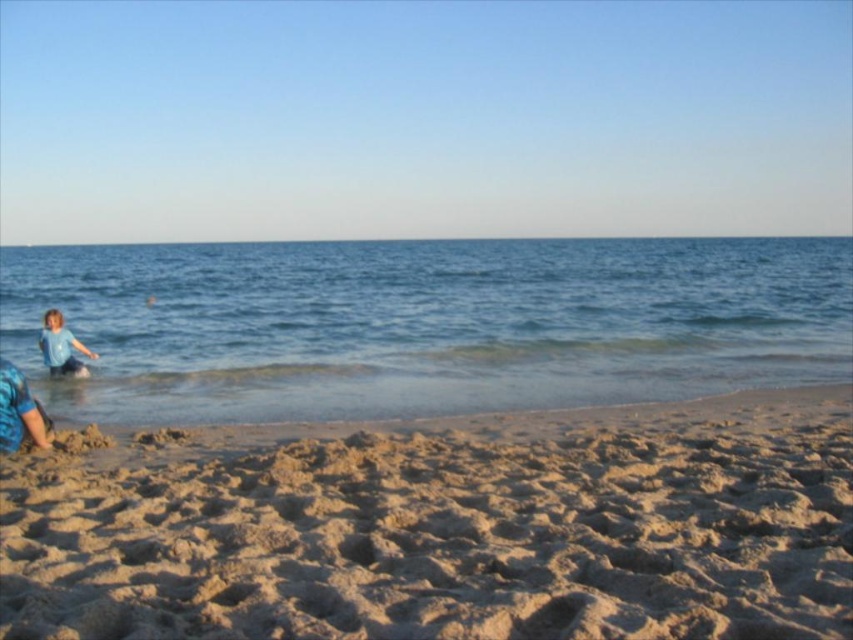
Question: Does blue liquid water at left have a greater width compared to light blue fabric shirt at left?

Choices:
 (A) yes
 (B) no

Answer: (A)

Question: Among these points, which one is nearest to the camera?

Choices:
 (A) (321, 289)
 (B) (38, 348)
 (C) (456, 566)

Answer: (C)

Question: Which is farther from the fine-grained sand at lower center?

Choices:
 (A) blue liquid water at left
 (B) light blue fabric shirt at left

Answer: (A)

Question: Is blue liquid water at left smaller than light blue fabric shirt at left?

Choices:
 (A) yes
 (B) no

Answer: (B)

Question: Is fine-grained sand at lower center bigger than light blue fabric shirt at left?

Choices:
 (A) yes
 (B) no

Answer: (B)

Question: Estimate the real-world distances between objects in this image. Which object is farther from the blue liquid water at left?

Choices:
 (A) fine-grained sand at lower center
 (B) light blue fabric shirt at left

Answer: (A)